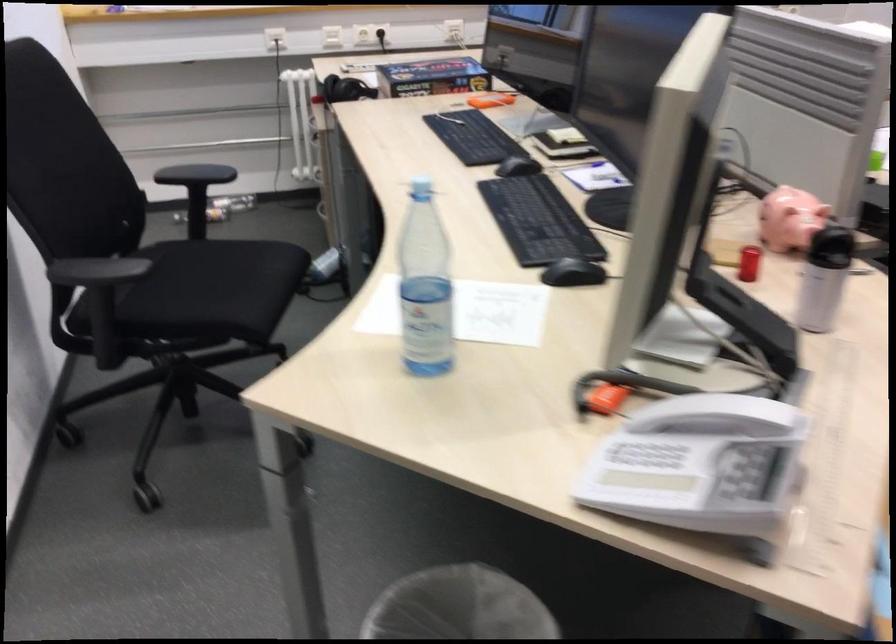
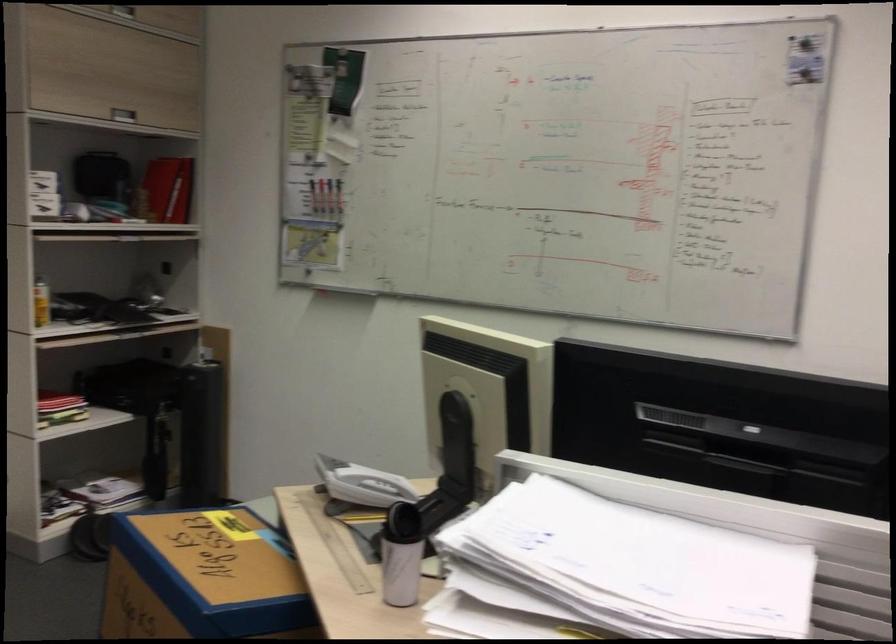
Find the pixel in the second image that matches point 823,287 in the first image.

(400, 570)